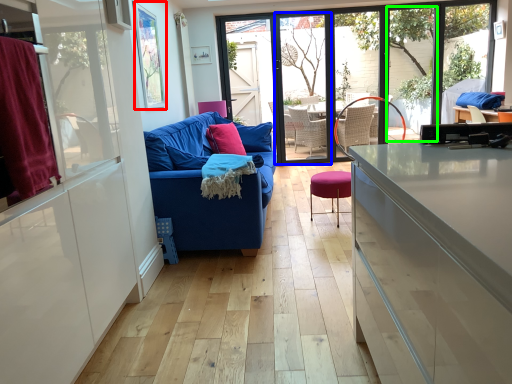
Question: Which is nearer to the window screen (highlighted by a red box)? screen door (highlighted by a blue box) or window (highlighted by a green box).

Choices:
 (A) screen door
 (B) window

Answer: (A)